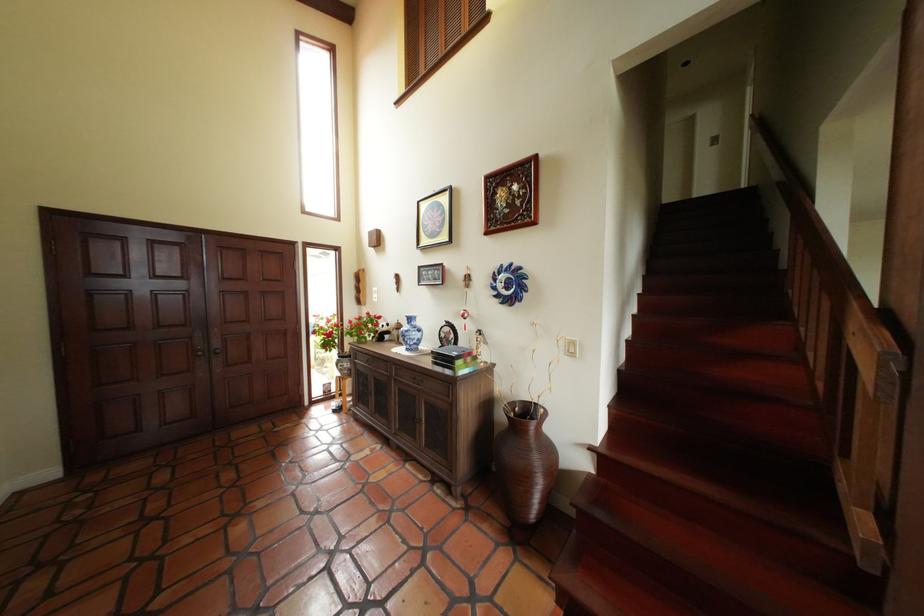
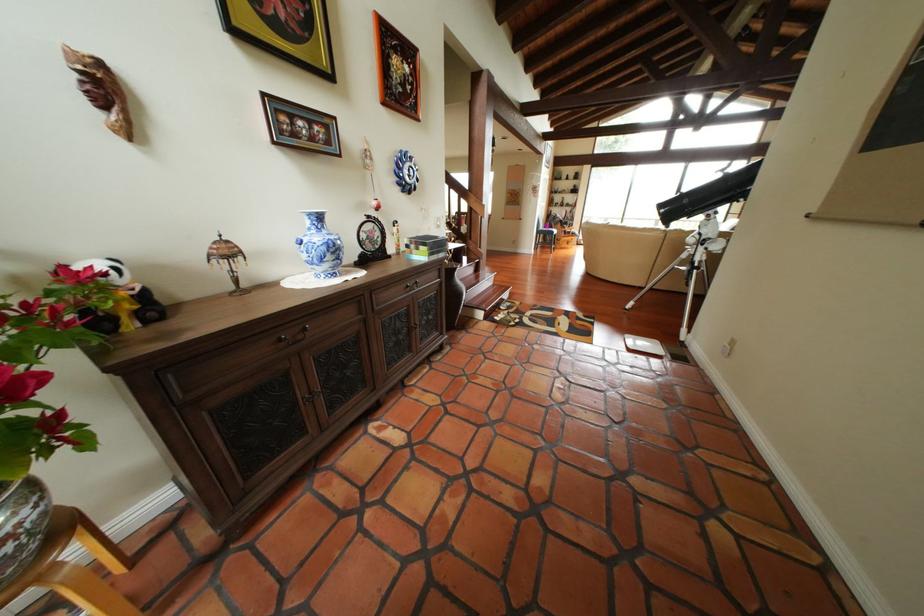
Locate, in the second image, the point that corresponds to pixel 354 367 in the first image.

(11, 546)